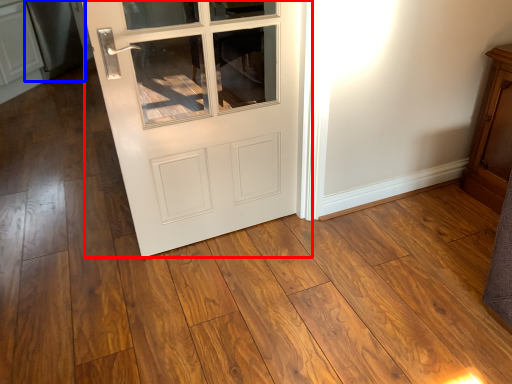
Question: Which point is closer to the camera, door (highlighted by a red box) or appliance (highlighted by a blue box)?

Choices:
 (A) door
 (B) appliance

Answer: (A)